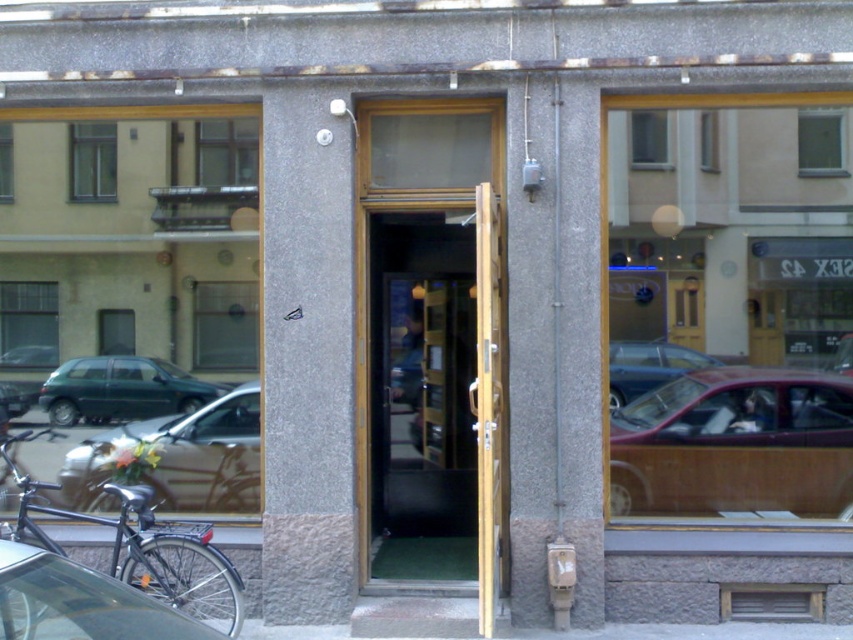
You are a delivery person who needs to park your van near the entrance of the building. The entrance is marked by the open wooden door. There are two cars in the way, the metallic silver car at lower left and the metallic red car at center. Which car is blocking the path closer to the entrance?

The metallic red car at center is blocking the path closer to the entrance because the metallic silver car at lower left is positioned under it, meaning the metallic red car is in front of the silver one.

You are a delivery person who needs to park your 1.8 meters tall package next to the wooden panel car at center and the metallic silver car at left. Which car should you place the package next to so it doesn

The wooden panel car at center has a greater height compared to the metallic silver car at left. Therefore, you should place the package next to the wooden panel car at center since its height matches the package.